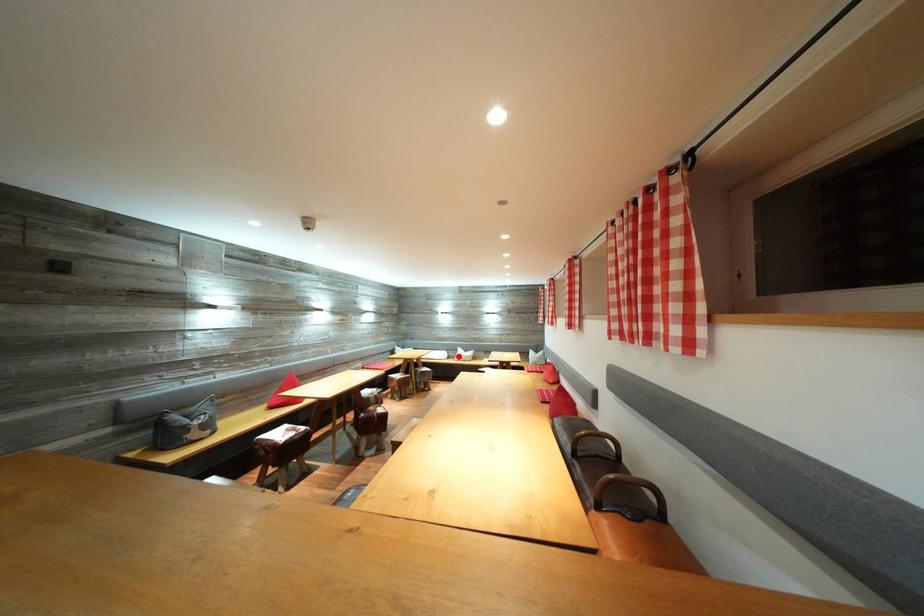
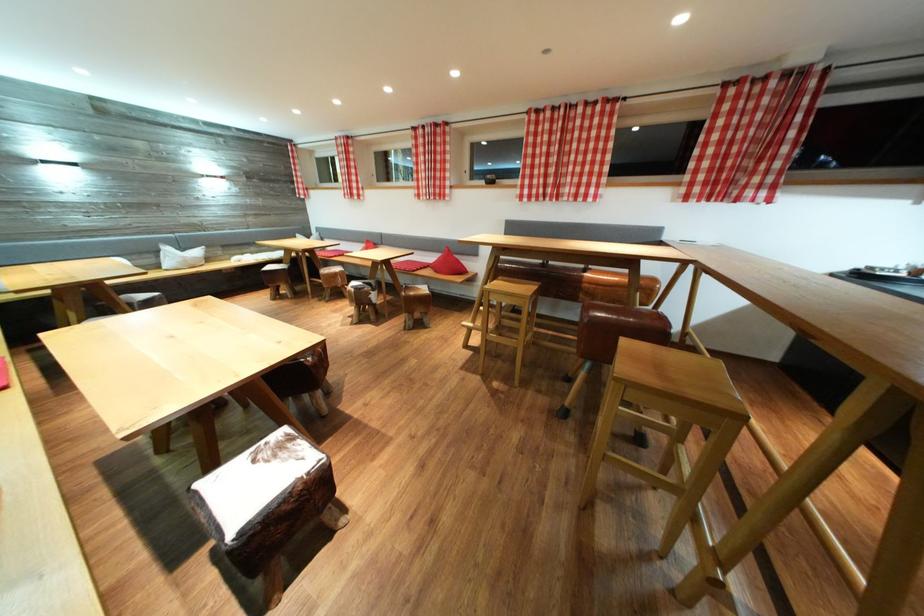
Question: I am providing you with two images of the same scene from different viewpoints. A red point is shown in image1. For the corresponding object point in image2, is it positioned nearer or farther from the camera?

Choices:
 (A) Nearer
 (B) Farther

Answer: (A)